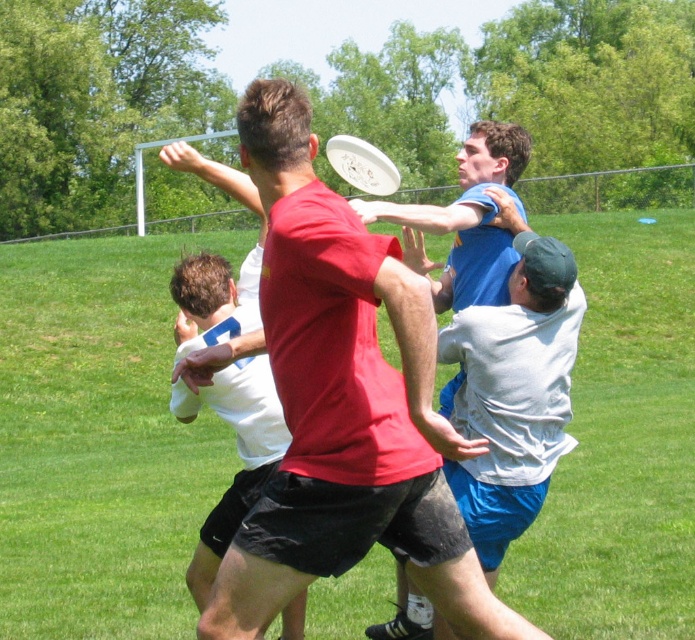
You are a sports analyst reviewing the ultimate frisbee game. You need to determine the position of the white matte jersey at center relative to the field. Based on the coordinates provided in the Objects Description, can you confirm if the jersey is closer to the center of the field or the edge?

The white matte jersey at center is located at point (237, 452). Since the coordinates are within the field, it is closer to the center of the field than the edge.

Based on the scene description, where is the green grass at center located in terms of its 2D coordinates?

The green grass at center is located at the 2D coordinates of point (99, 440).

You are a photographer trying to capture the ultimate frisbee game. You want to ensure that both the green grass at center and the white plastic frisbee at center are clearly visible in your photo. Based on their positions, which object should you focus on first to ensure both are in focus?

Since the green grass at center is positioned under the white plastic frisbee at center, focusing on the white plastic frisbee at center first will ensure both objects are in focus as the grass is behind it.